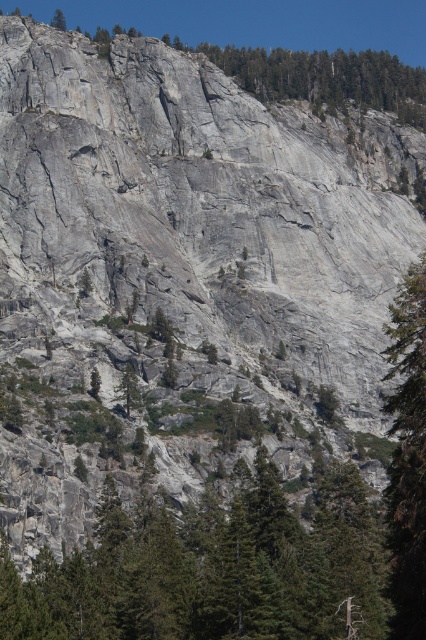
Between green textured tree at right and green textured tree at upper left, which one appears on the right side from the viewer's perspective?

Positioned to the right is green textured tree at right.

Where is `green textured tree at right`? This screenshot has width=426, height=640. green textured tree at right is located at coordinates (408, 458).

Locate an element on the screen. This screenshot has height=640, width=426. green textured tree at right is located at coordinates (408, 458).

Who is more distant from viewer, [322,557] or [62,19]?

The point [62,19] is more distant.

Can you confirm if green matte tree at lower center is positioned to the right of green textured tree at upper left?

Correct, you'll find green matte tree at lower center to the right of green textured tree at upper left.

Where is `green matte tree at lower center`? green matte tree at lower center is located at coordinates (210, 568).

Is point (268, 486) more distant than point (391, 536)?

That is True.

Can you confirm if green matte tree at lower center is bigger than green textured tree at right?

Actually, green matte tree at lower center might be smaller than green textured tree at right.

Which is behind, point (124, 589) or point (405, 314)?

The point (124, 589) is behind.

Locate an element on the screen. The image size is (426, 640). green matte tree at lower center is located at coordinates (210, 568).